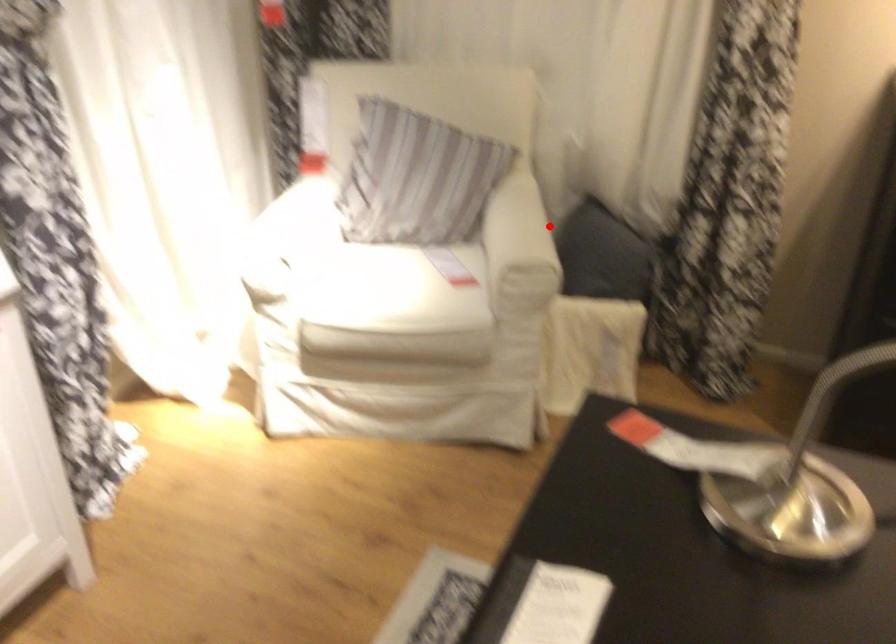
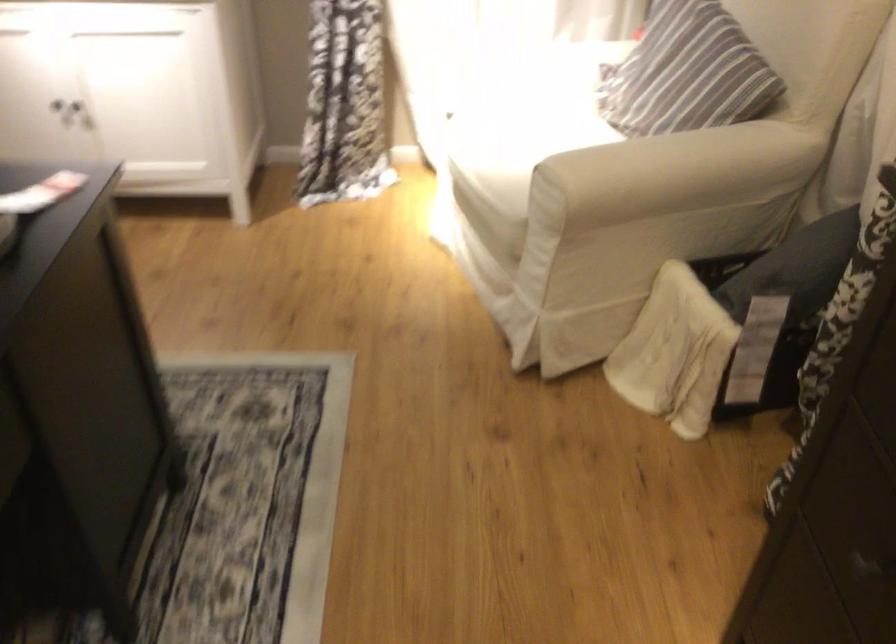
Question: I am providing you with two images of the same scene from different viewpoints. In image1, a red point is highlighted. Considering the same 3D point in image2, which of the following is correct?

Choices:
 (A) It is closer
 (B) It is farther

Answer: (A)